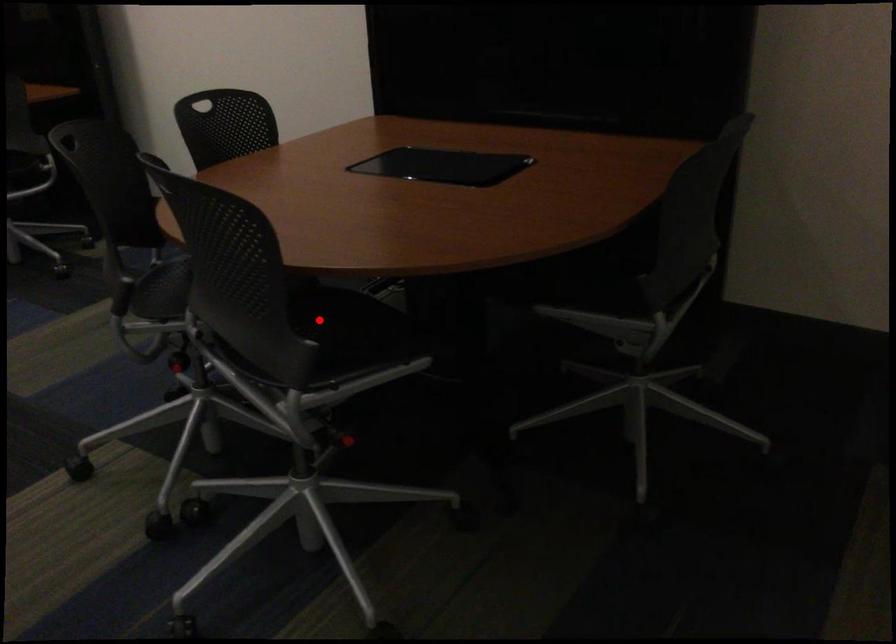
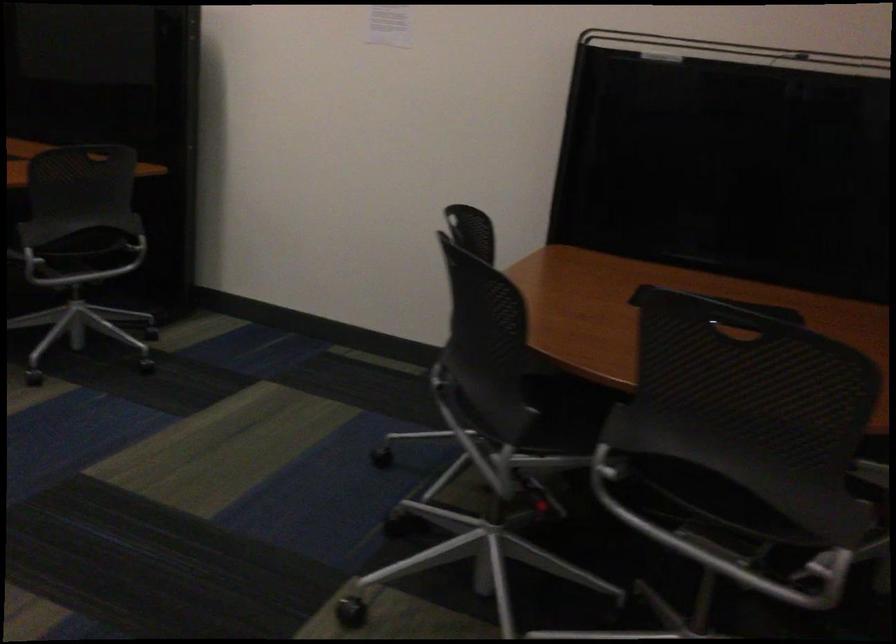
Question: I am providing you with two images of the same scene from different viewpoints. A red point is marked on the first image. Can you still see the location of the red point in image 2?

Choices:
 (A) Yes
 (B) No

Answer: (B)